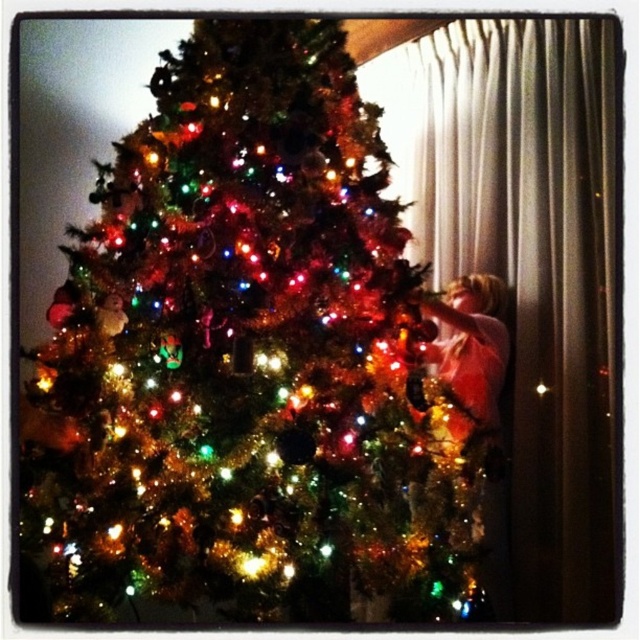
You are standing in front of the festive scene with the iridescent shiny tree at center and the shiny gold dress at right. Which object is wider?

The iridescent shiny tree at center is wider than the shiny gold dress at right.

You are standing in front of the Christmas tree and notice two points marked on it. The first point is at coordinates point (x=220, y=150) and the second is at point (x=467, y=291). Which point is closer to your eyes?

Point (x=220, y=150) is closer to the camera than point (x=467, y=291), so the first point is closer to your eyes.

You are standing in front of the festive scene with the iridescent shiny tree at center and the shiny gold dress at right. Which object is closer to you?

The iridescent shiny tree at center is closer to you because it is in front of the shiny gold dress at right.